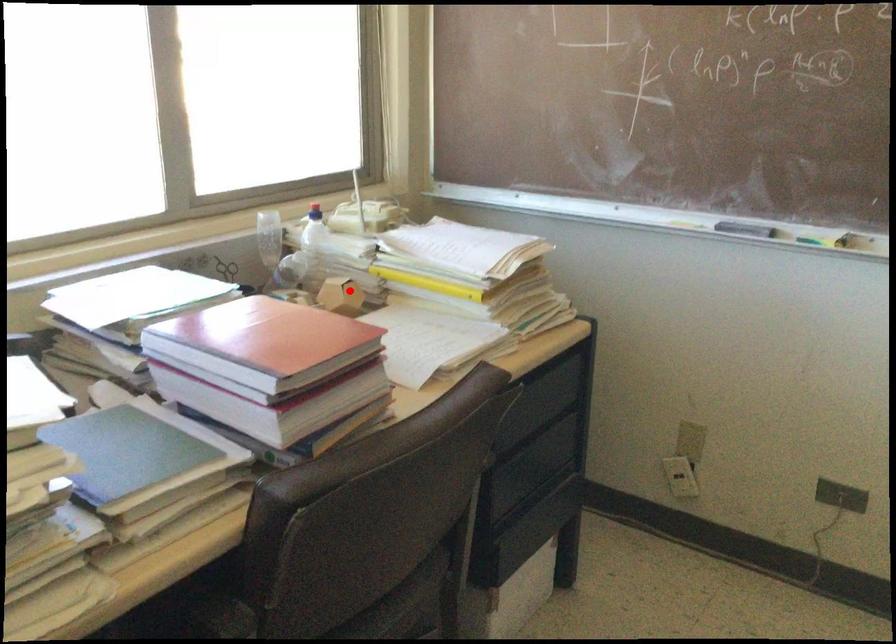
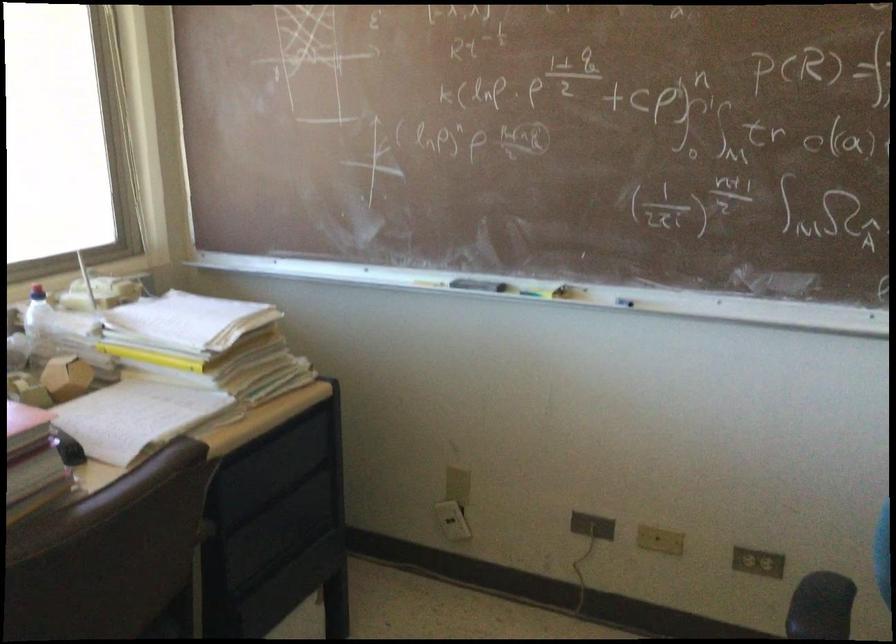
Where in the second image is the point corresponding to the highlighted location from the first image?

(65, 377)